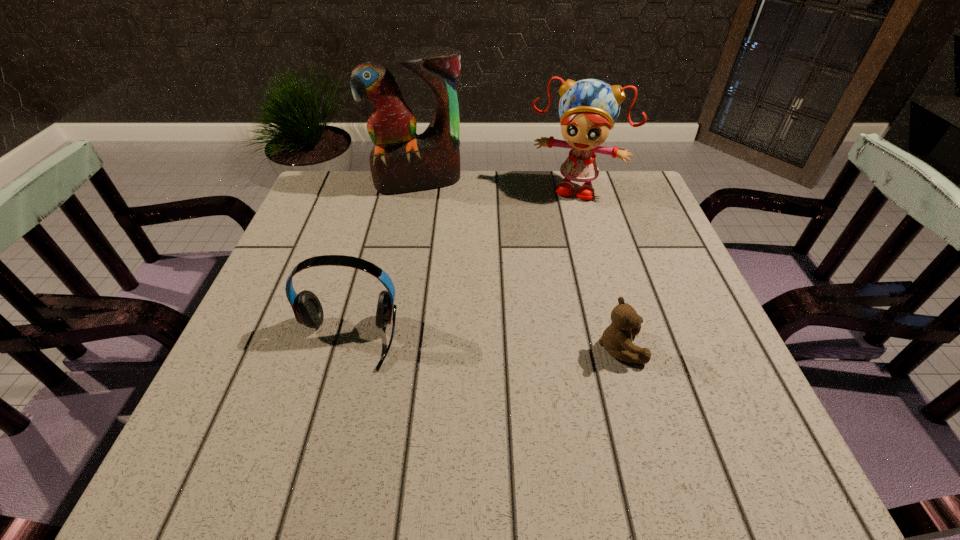
What are the coordinates of `free space located on the face of the second tallest object` in the screenshot? It's located at tap(550, 240).

Where is `blank area located 0.310m on the face of the second tallest object`? The height and width of the screenshot is (540, 960). blank area located 0.310m on the face of the second tallest object is located at coordinates (537, 279).

The image size is (960, 540). Identify the location of parrot at the far edge. (401, 161).

Identify the location of doll that is at the far edge. (588, 109).

Locate an element on the screen. This screenshot has width=960, height=540. object that is at the near edge is located at coordinates (308, 311).

At what (x,y) coordinates should I click in order to perform the action: click on headset that is at the left edge. Please return your answer as a coordinate pair (x, y). This screenshot has height=540, width=960. Looking at the image, I should click on (308, 311).

Where is `parrot that is at the left edge`? This screenshot has height=540, width=960. parrot that is at the left edge is located at coordinates (401, 161).

In order to click on teddy bear located at the right edge in this screenshot , I will do `click(617, 338)`.

The height and width of the screenshot is (540, 960). Identify the location of doll that is at the right edge. (588, 109).

Find the location of a particular element. The height and width of the screenshot is (540, 960). object that is at the far left corner is located at coordinates (401, 161).